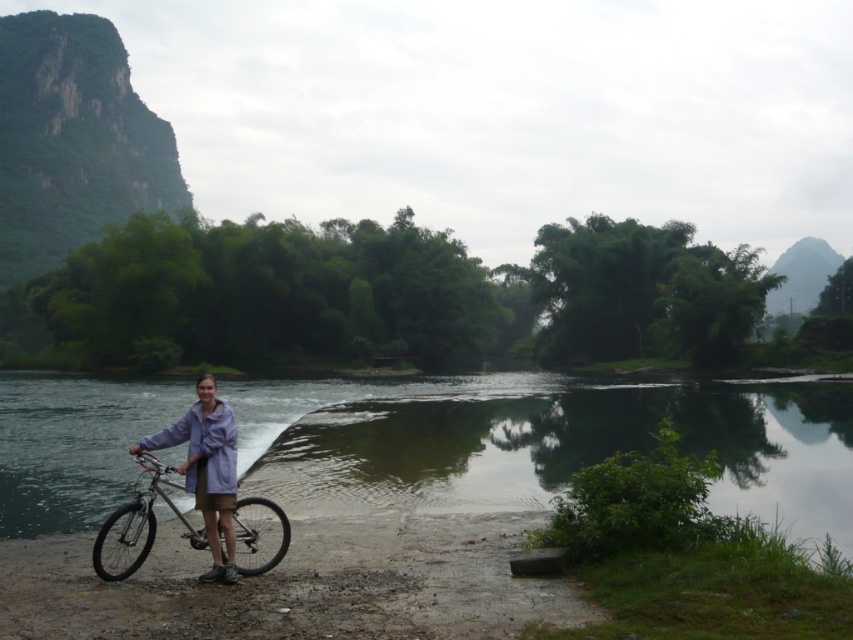
You are trying to decide whether to place a new bench between the silver metallic bicycle at lower left and the light purple fabric shirt at center. The bench requires 2 meters of space. Based on the scene, is there enough space between them?

The silver metallic bicycle at lower left is thinner than the light purple fabric shirt at center, but the exact distance between them isn not specified. Without knowing the actual spacing, it is impossible to determine if there is enough room for the 2 meter bench.

You are a photographer trying to capture the reflection of the green reflective water at center in your shot. However, the silver metallic bicycle at lower left is blocking the view. Can you move the bicycle to the side to get a clearer reflection?

The green reflective water at center is further to the viewer than the silver metallic bicycle at lower left, so moving the bicycle might not be necessary as the water is already closer to the photographer. However, since the bicycle is blocking the view, moving it aside could help capture the reflection better.

You are a photographer standing at the riverbank. You want to capture a clear reflection of the green reflective water at center in your shot. Since the water is still, you need to be at least 20 feet away to avoid disturbing it. Can you take the photo from your current position?

The green reflective water at center is 23.33 feet from the camera, which means you are 23.33 feet away. Since this distance is more than 20 feet, you can take the photo without disturbing the water.